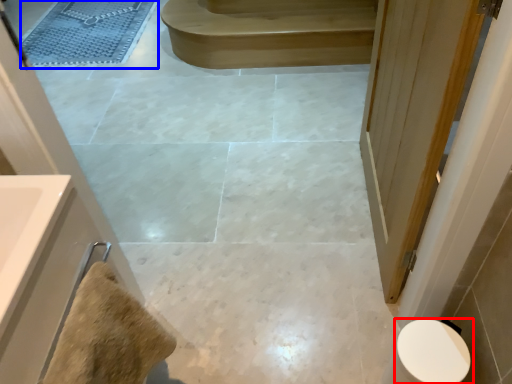
Question: Which object appears closest to the camera in this image, toilet (highlighted by a red box) or bath mat (highlighted by a blue box)?

Choices:
 (A) toilet
 (B) bath mat

Answer: (A)